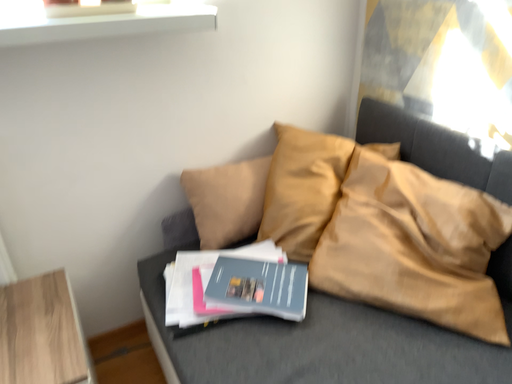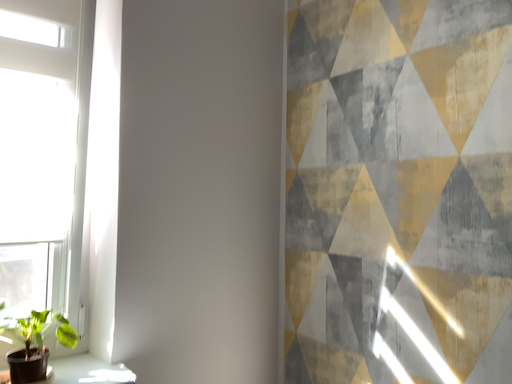
Question: How did the camera likely rotate when shooting the video?

Choices:
 (A) rotated upward
 (B) rotated downward

Answer: (A)